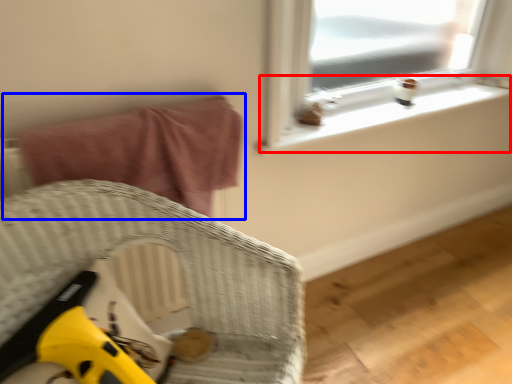
Question: Which of the following is the farthest to the observer, window sill (highlighted by a red box) or bed (highlighted by a blue box)?

Choices:
 (A) window sill
 (B) bed

Answer: (A)